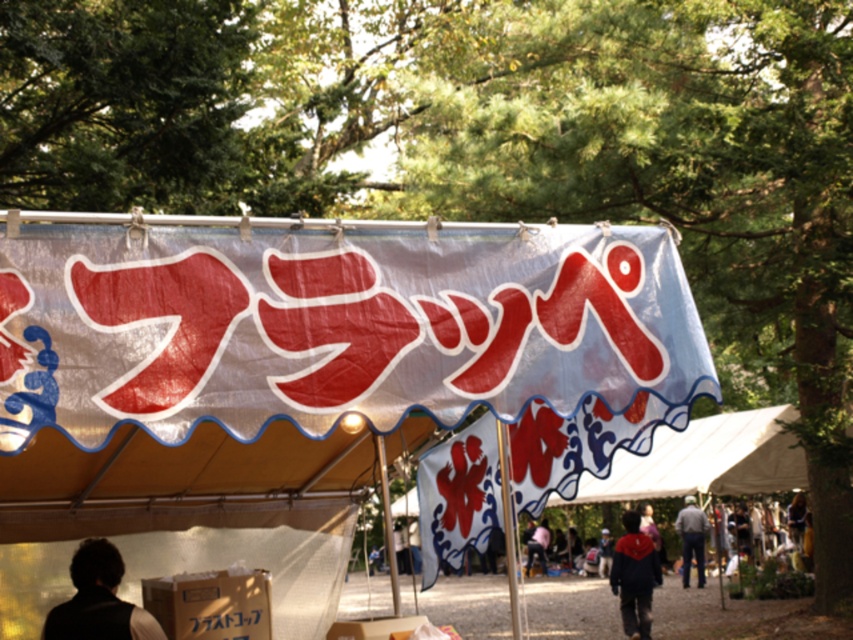
Question: Is white fabric tent at center closer to camera compared to dark brown hair at lower left?

Choices:
 (A) no
 (B) yes

Answer: (A)

Question: Estimate the real-world distances between objects in this image. Which object is closer to the gray fabric jacket at lower right?

Choices:
 (A) red velvet cape at center
 (B) white fabric tent at center
 (C) dark brown hair at lower left

Answer: (A)

Question: Considering the real-world distances, which object is farthest from the dark brown hair at lower left?

Choices:
 (A) gray fabric jacket at lower right
 (B) red velvet cape at center

Answer: (A)

Question: Which point is closer to the camera taking this photo?

Choices:
 (A) (611, 561)
 (B) (112, 552)

Answer: (B)

Question: Is dark brown hair at lower left smaller than gray fabric jacket at lower right?

Choices:
 (A) no
 (B) yes

Answer: (B)

Question: Can you confirm if dark brown hair at lower left is wider than red velvet cape at center?

Choices:
 (A) yes
 (B) no

Answer: (B)